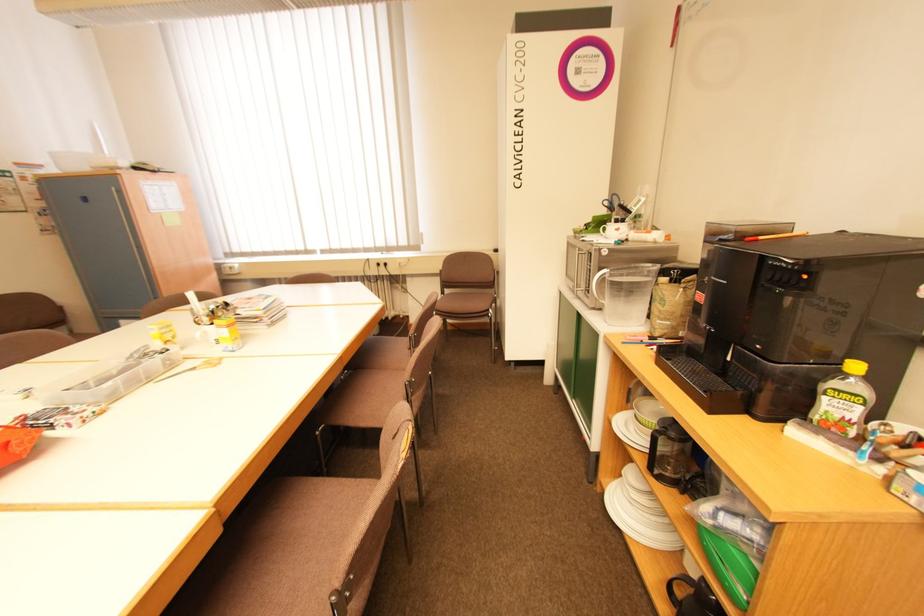
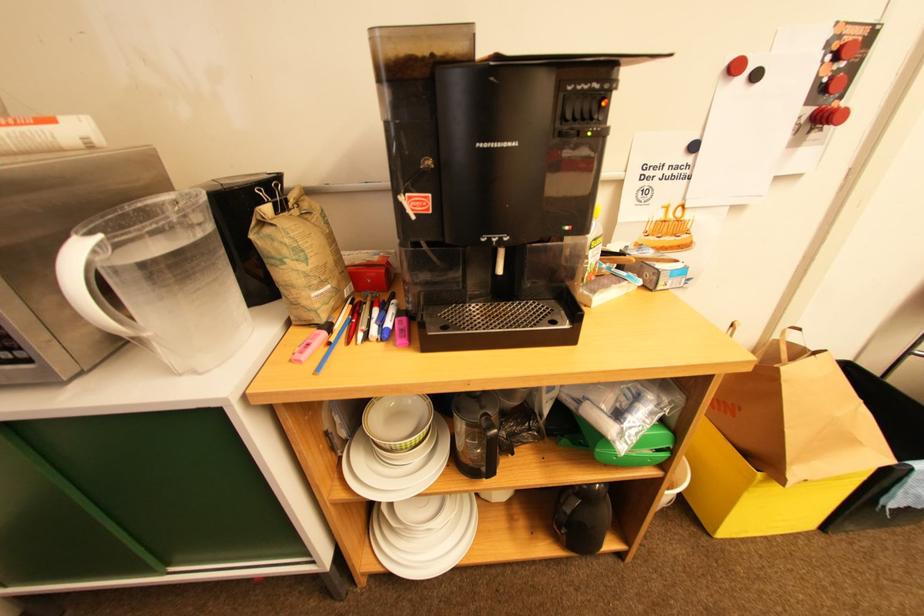
How did the camera likely rotate?

The rotation direction of the camera is right-down.